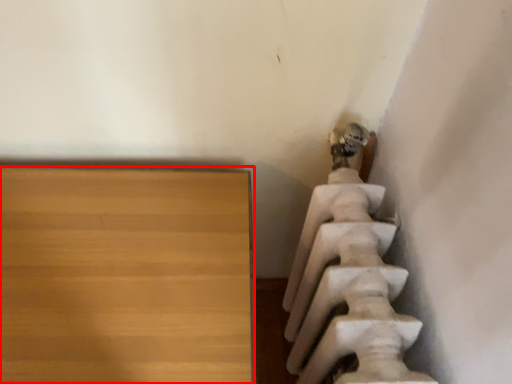
Question: From the image's perspective, what is the correct spatial relationship of furniture (annotated by the red box) in relation to statue (sculpture)?

Choices:
 (A) above
 (B) below

Answer: (B)